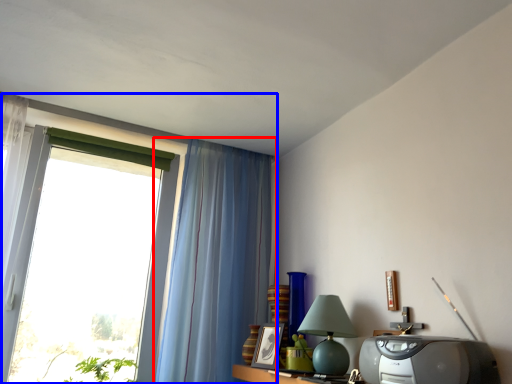
Question: Which of the following is the farthest to the observer, curtain (highlighted by a red box) or window (highlighted by a blue box)?

Choices:
 (A) curtain
 (B) window

Answer: (A)